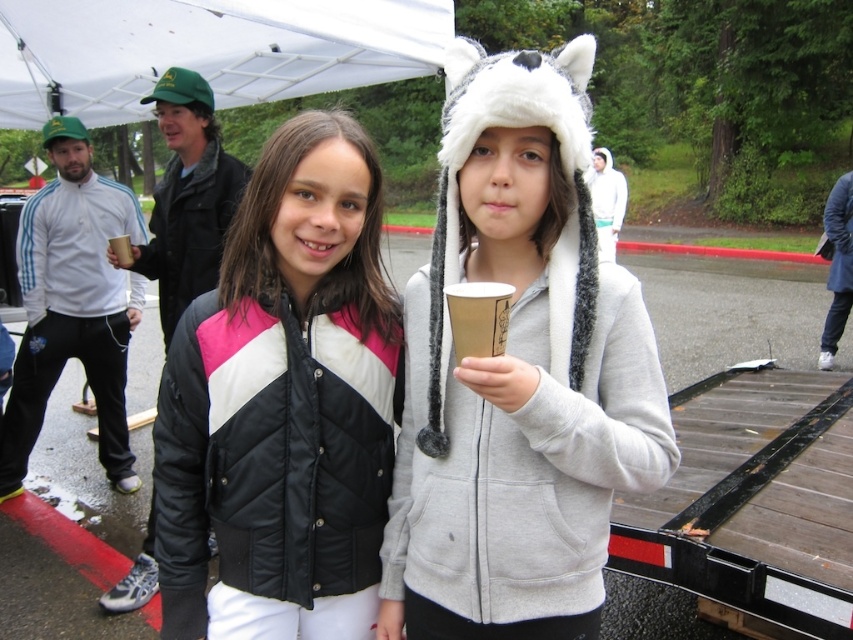
Between white fabric canopy at upper center and brown paper cup at center, which one is positioned higher?

white fabric canopy at upper center is higher up.

In the scene shown: Is white fabric canopy at upper center positioned behind brown paper cup at center?

Yes.

Locate an element on the screen. Image resolution: width=853 pixels, height=640 pixels. white fabric canopy at upper center is located at coordinates (206, 51).

Between gray fleece hoodie at center and black quilted jacket at center, which one is positioned higher?

Positioned higher is gray fleece hoodie at center.

Looking at this image, does gray fleece hoodie at center have a lesser height compared to black quilted jacket at center?

No, gray fleece hoodie at center is not shorter than black quilted jacket at center.

Between point (590, 243) and point (171, 589), which one is positioned in front?

Point (590, 243) is more forward.

Where is `gray fleece hoodie at center`? The height and width of the screenshot is (640, 853). gray fleece hoodie at center is located at coordinates (518, 372).

Who is positioned more to the left, brown paper cup at center or brown paper cup at left?

brown paper cup at left

The image size is (853, 640). I want to click on brown paper cup at center, so click(x=479, y=317).

Is point (476, 291) farther from camera compared to point (114, 259)?

No, it is not.

I want to click on brown paper cup at center, so click(x=479, y=317).